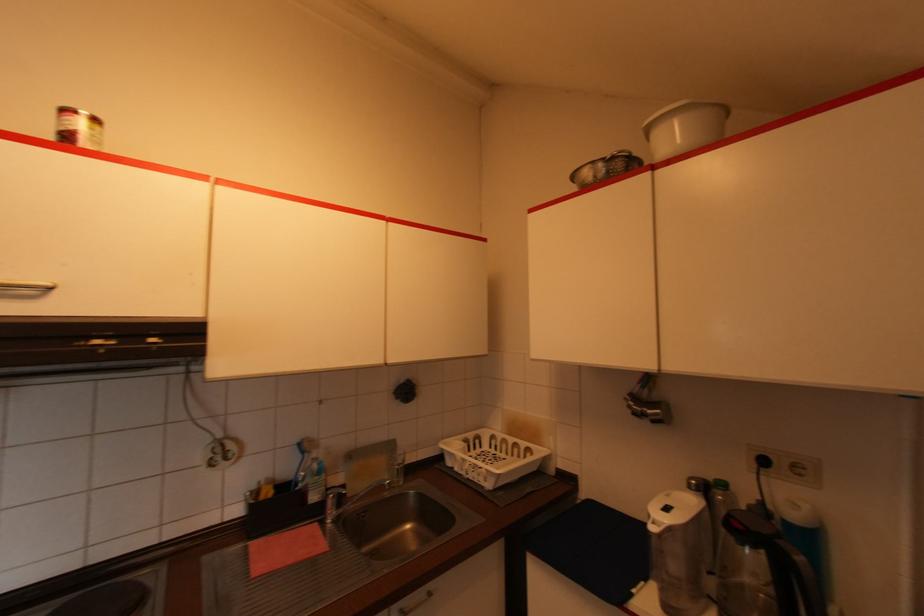
Where is `drawer handle`? drawer handle is located at coordinates (415, 604).